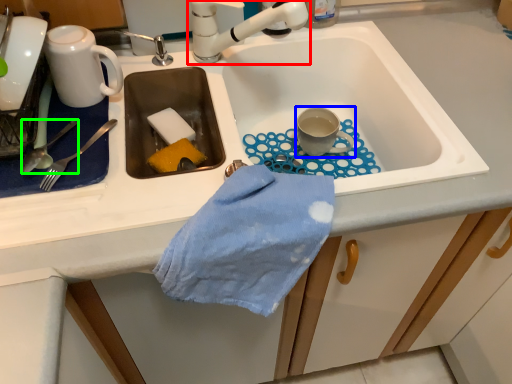
Question: Which is farther away from tap (highlighted by a red box)? coffee cup (highlighted by a blue box) or silverware (highlighted by a green box)?

Choices:
 (A) coffee cup
 (B) silverware

Answer: (B)